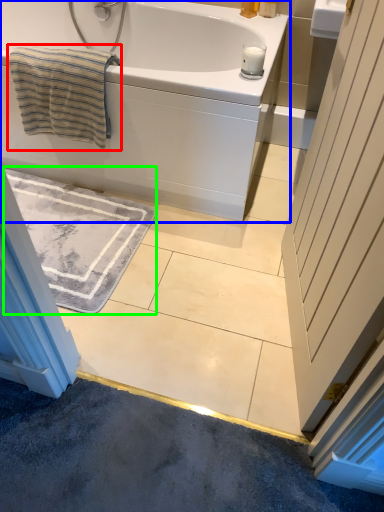
Question: Estimate the real-world distances between objects in this image. Which object is closer to beach towel (highlighted by a red box), bathtub (highlighted by a blue box) or bath mat (highlighted by a green box)?

Choices:
 (A) bathtub
 (B) bath mat

Answer: (A)